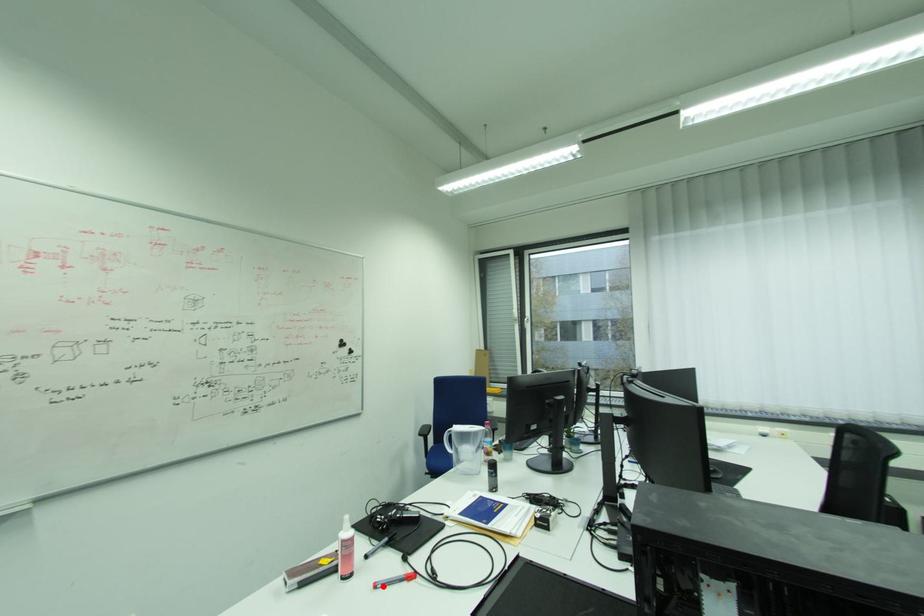
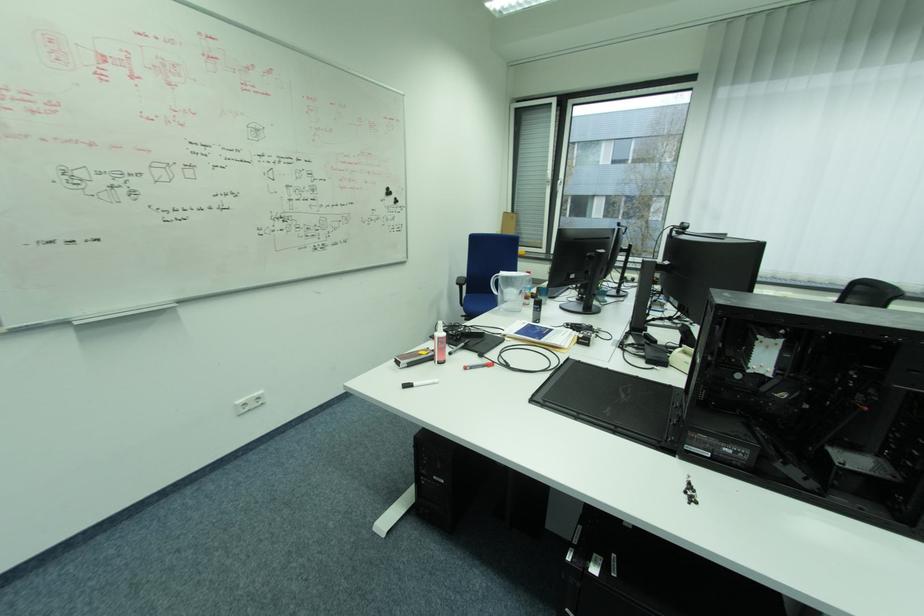
Find the pixel in the second image that matches the highlighted location in the first image.

(472, 369)